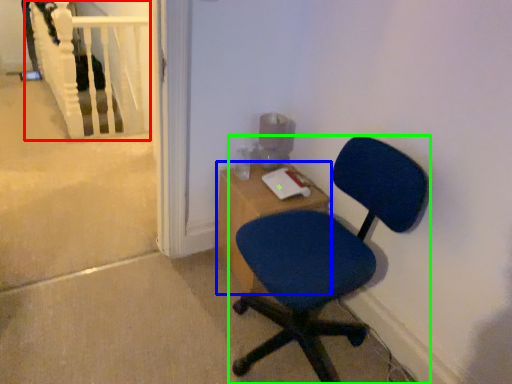
Question: Which object is positioned farthest from rail (highlighted by a red box)? Select from desk (highlighted by a blue box) and chair (highlighted by a green box).

Choices:
 (A) desk
 (B) chair

Answer: (B)